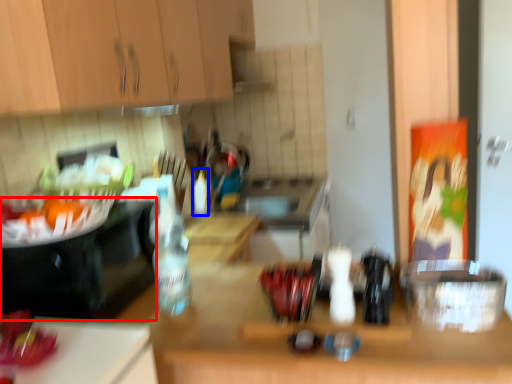
Question: Which of the following is the farthest to the observer, appliance (highlighted by a red box) or bottle (highlighted by a blue box)?

Choices:
 (A) appliance
 (B) bottle

Answer: (B)